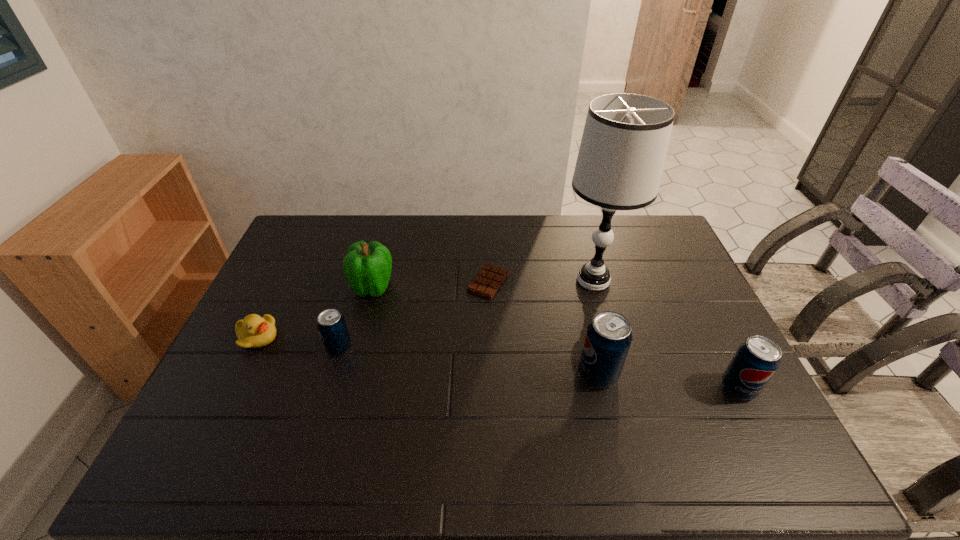
The height and width of the screenshot is (540, 960). What are the coordinates of `object present at the right edge` in the screenshot? It's located at (756, 360).

Find the location of a particular element. The height and width of the screenshot is (540, 960). object positioned at the near right corner is located at coordinates (756, 360).

Locate an element on the screen. free space at the far edge of the desktop is located at coordinates (515, 243).

The image size is (960, 540). What are the coordinates of `vacant space at the near edge of the desktop` in the screenshot? It's located at (x=582, y=407).

The height and width of the screenshot is (540, 960). In the image, there is a desktop. Find the location of `vacant space at the right edge`. vacant space at the right edge is located at coordinates (677, 310).

Where is `free region at the far left corner`? The width and height of the screenshot is (960, 540). free region at the far left corner is located at coordinates 329,234.

This screenshot has width=960, height=540. In the image, there is a desktop. In order to click on free space at the far right corner in this screenshot , I will do `click(636, 248)`.

The image size is (960, 540). Identify the location of free space between the tallest object and the rightmost object. (665, 334).

The height and width of the screenshot is (540, 960). I want to click on empty location between the shortest object and the fifth tallest object, so click(x=414, y=315).

Find the location of a particular element. This screenshot has height=540, width=960. free space between the leftmost object and the bell pepper is located at coordinates (315, 312).